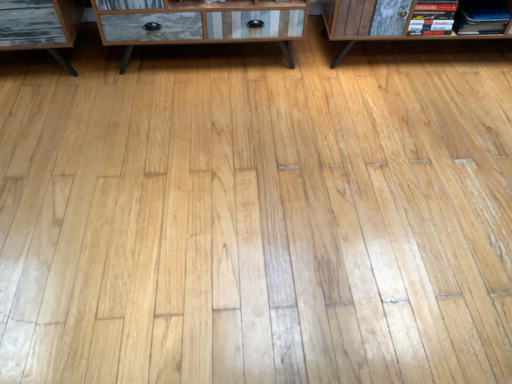
Identify the location of empty space that is ontop of matte black book at upper right, which ranks as the 1th book in right-to-left order. (483, 9).